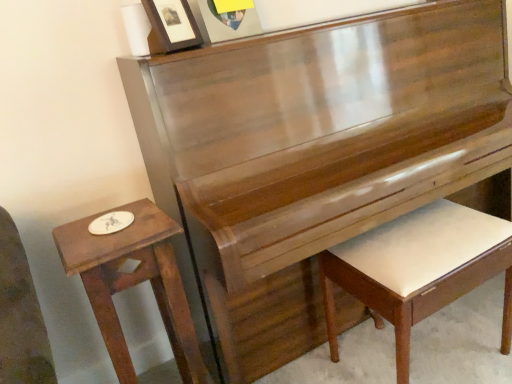
Question: Is matte wooden picture frame at upper center, the second picture frame viewed from the left, further to camera compared to white leather piano bench at lower right?

Choices:
 (A) no
 (B) yes

Answer: (B)

Question: Does matte wooden picture frame at upper center, placed as the first picture frame when sorted from right to left, have a lesser width compared to white leather piano bench at lower right?

Choices:
 (A) yes
 (B) no

Answer: (A)

Question: Is white leather piano bench at lower right located within matte wooden picture frame at upper center, the second picture frame viewed from the left?

Choices:
 (A) yes
 (B) no

Answer: (B)

Question: Are matte wooden picture frame at upper center, placed as the first picture frame when sorted from right to left, and white leather piano bench at lower right located far from each other?

Choices:
 (A) no
 (B) yes

Answer: (A)

Question: Is matte wooden picture frame at upper center, the second picture frame viewed from the left, taller than white leather piano bench at lower right?

Choices:
 (A) no
 (B) yes

Answer: (A)

Question: From the image's perspective, is matte black picture frame at upper center, placed as the second picture frame when sorted from right to left, positioned above or below matte wooden picture frame at upper center, placed as the first picture frame when sorted from right to left?

Choices:
 (A) above
 (B) below

Answer: (B)

Question: From a real-world perspective, relative to matte wooden picture frame at upper center, the second picture frame viewed from the left, is matte black picture frame at upper center, placed as the second picture frame when sorted from right to left, vertically above or below?

Choices:
 (A) above
 (B) below

Answer: (A)

Question: Considering the positions of matte black picture frame at upper center, arranged as the 1th picture frame when viewed from the left, and matte wooden picture frame at upper center, the second picture frame viewed from the left, in the image, is matte black picture frame at upper center, arranged as the 1th picture frame when viewed from the left, taller or shorter than matte wooden picture frame at upper center, the second picture frame viewed from the left,?

Choices:
 (A) tall
 (B) short

Answer: (B)

Question: Does point (190, 11) appear closer or farther from the camera than point (222, 41)?

Choices:
 (A) closer
 (B) farther

Answer: (B)

Question: In terms of height, does matte black picture frame at upper center, placed as the second picture frame when sorted from right to left, look taller or shorter compared to white leather piano bench at lower right?

Choices:
 (A) short
 (B) tall

Answer: (A)

Question: Is matte black picture frame at upper center, placed as the second picture frame when sorted from right to left, situated inside white leather piano bench at lower right or outside?

Choices:
 (A) inside
 (B) outside

Answer: (B)

Question: Considering the positions of matte black picture frame at upper center, arranged as the 1th picture frame when viewed from the left, and white leather piano bench at lower right in the image, is matte black picture frame at upper center, arranged as the 1th picture frame when viewed from the left, wider or thinner than white leather piano bench at lower right?

Choices:
 (A) thin
 (B) wide

Answer: (A)

Question: Based on their sizes in the image, would you say matte black picture frame at upper center, arranged as the 1th picture frame when viewed from the left, is bigger or smaller than white leather piano bench at lower right?

Choices:
 (A) big
 (B) small

Answer: (B)

Question: From a real-world perspective, is wooden table at left physically located above or below matte wooden picture frame at upper center, placed as the first picture frame when sorted from right to left?

Choices:
 (A) below
 (B) above

Answer: (A)

Question: From the image's perspective, is wooden table at left above or below matte wooden picture frame at upper center, placed as the first picture frame when sorted from right to left?

Choices:
 (A) below
 (B) above

Answer: (A)